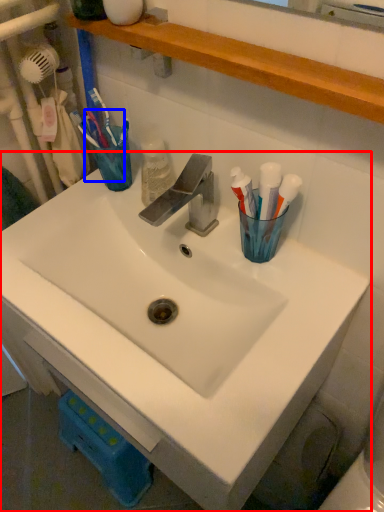
Question: Which point is further to the camera, sink (highlighted by a red box) or toothbrush (highlighted by a blue box)?

Choices:
 (A) sink
 (B) toothbrush

Answer: (B)